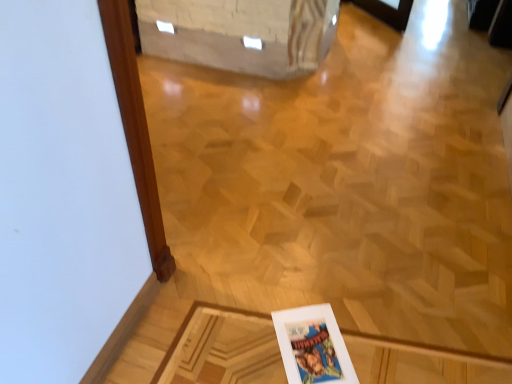
Identify the location of white matte picture frame at lower center. (313, 346).

What do you see at coordinates (313, 346) in the screenshot? This screenshot has width=512, height=384. I see `white matte picture frame at lower center` at bounding box center [313, 346].

In order to click on white matte picture frame at lower center in this screenshot , I will do `click(313, 346)`.